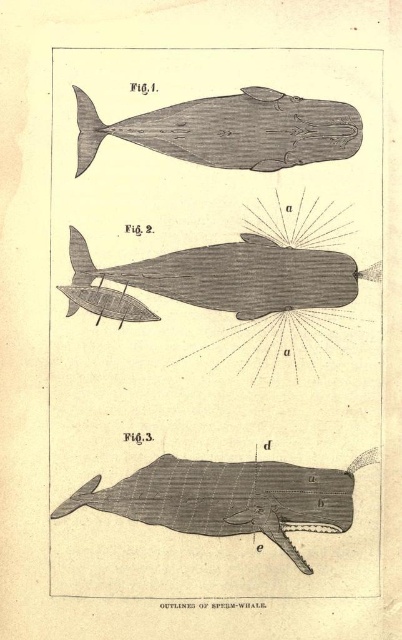
Question: Which point is farther to the camera?

Choices:
 (A) gray wood humpback whale at center
 (B) grid-patterned whale at bottom

Answer: (B)

Question: Is gray textured whale at center below gray wood humpback whale at center?

Choices:
 (A) yes
 (B) no

Answer: (A)

Question: Estimate the real-world distances between objects in this image. Which object is closer to the gray textured whale at center?

Choices:
 (A) gray wood humpback whale at center
 (B) grid-patterned whale at bottom

Answer: (B)

Question: Considering the real-world distances, which object is farthest from the gray textured whale at center?

Choices:
 (A) grid-patterned whale at bottom
 (B) gray wood humpback whale at center

Answer: (B)

Question: Can you confirm if gray textured whale at center is positioned below grid-patterned whale at bottom?

Choices:
 (A) yes
 (B) no

Answer: (B)

Question: Observing the image, what is the correct spatial positioning of gray textured whale at center in reference to grid-patterned whale at bottom?

Choices:
 (A) below
 (B) above

Answer: (B)